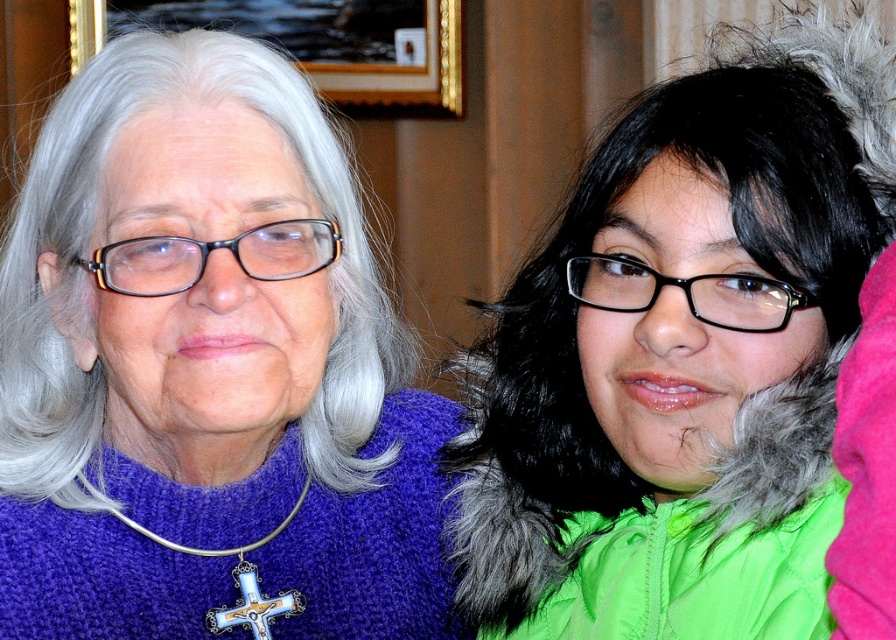
Question: Which point is farther to the camera?

Choices:
 (A) green fuzzy coat at right
 (B) black acetate glasses at upper left
 (C) purple knitted sweater at center
 (D) black plastic glasses at center

Answer: (B)

Question: Among these objects, which one is farthest from the camera?

Choices:
 (A) black acetate glasses at upper left
 (B) black plastic glasses at center
 (C) gold-framed picture at upper center
 (D) green fuzzy coat at right

Answer: (C)

Question: Which of these objects is positioned closest to the black plastic glasses at center?

Choices:
 (A) green fuzzy coat at right
 (B) black acetate glasses at upper left
 (C) gold-framed picture at upper center

Answer: (A)

Question: Does purple knitted sweater at center appear under black plastic glasses at center?

Choices:
 (A) yes
 (B) no

Answer: (A)

Question: Is purple knitted sweater at center bigger than black plastic glasses at center?

Choices:
 (A) no
 (B) yes

Answer: (B)

Question: Can you confirm if purple knitted sweater at center is bigger than gold-framed picture at upper center?

Choices:
 (A) no
 (B) yes

Answer: (A)